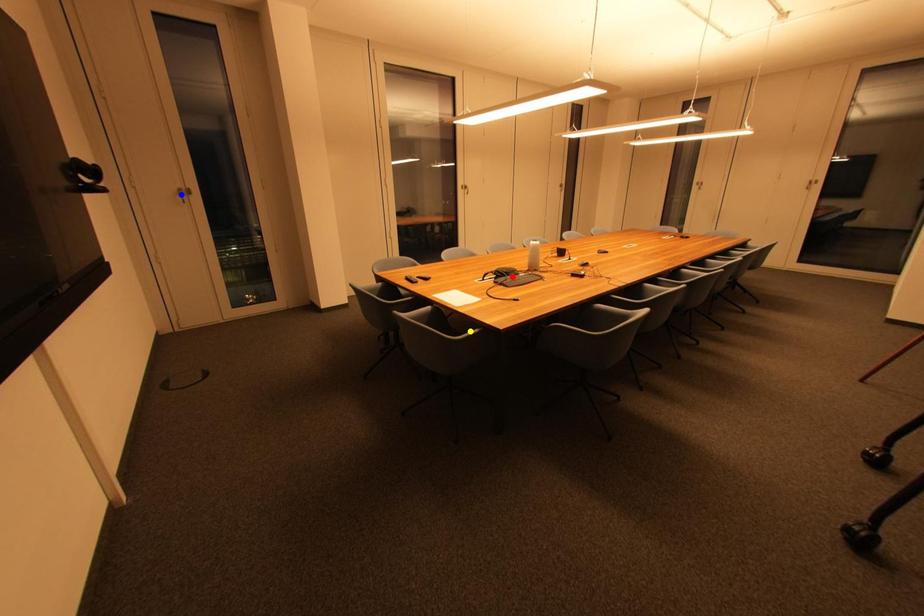
Order these from nearest to farthest:
- yellow point
- blue point
- red point

blue point
red point
yellow point